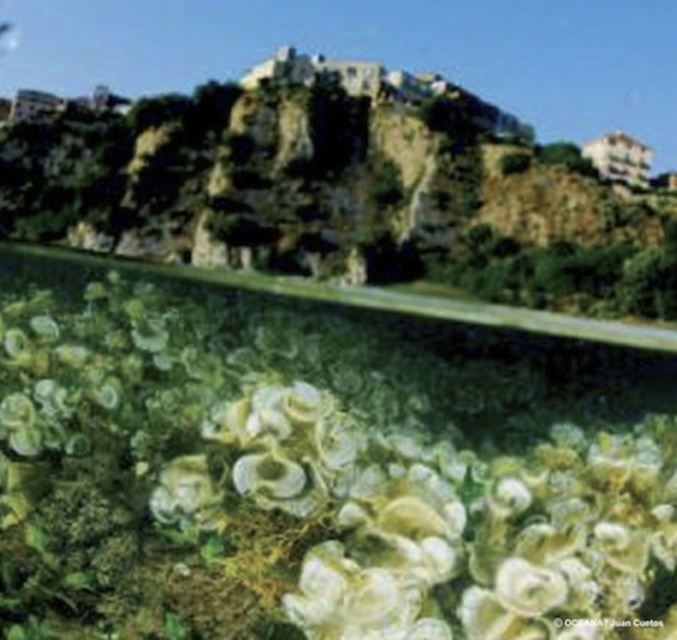
Question: Which point is farther to the camera?

Choices:
 (A) (452, 211)
 (B) (573, 600)

Answer: (A)

Question: Where is white matte coral at center located in relation to brown rocky hillside at upper center in the image?

Choices:
 (A) above
 (B) below

Answer: (B)

Question: Which of the following is the farthest from the observer?

Choices:
 (A) white matte coral at center
 (B) brown rocky hillside at upper center

Answer: (B)

Question: Can you confirm if white matte coral at center is positioned to the right of brown rocky hillside at upper center?

Choices:
 (A) yes
 (B) no

Answer: (B)

Question: Does white matte coral at center have a smaller size compared to brown rocky hillside at upper center?

Choices:
 (A) yes
 (B) no

Answer: (A)